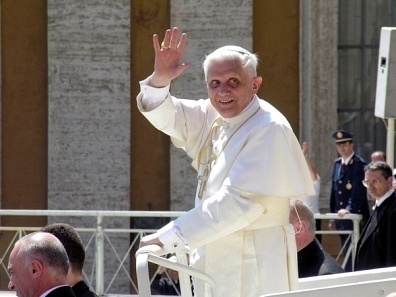
Image resolution: width=396 pixels, height=297 pixels. Find the location of `robe`. robe is located at coordinates (275, 159).